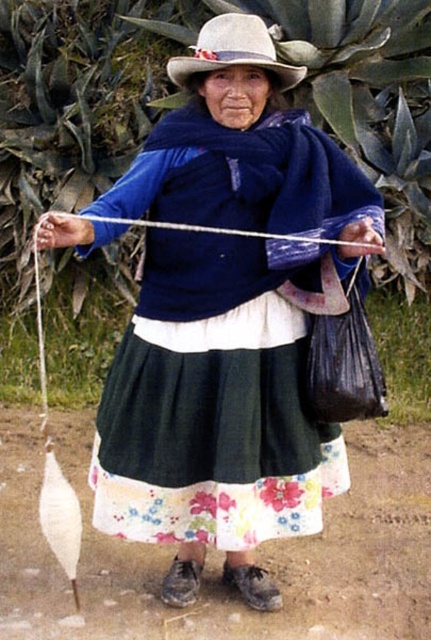
Which is in front, point (311, 272) or point (368, 224)?

Point (368, 224) is in front.

Which is more to the left, matte blue sweater at center or white string at center?

matte blue sweater at center

Locate an element on the screen. matte blue sweater at center is located at coordinates (227, 317).

Can you confirm if matte blue sweater at center is positioned above white felt cowboy hat at upper center?

No, matte blue sweater at center is not above white felt cowboy hat at upper center.

Describe the element at coordinates (227, 317) in the screenshot. I see `matte blue sweater at center` at that location.

The width and height of the screenshot is (431, 640). In order to click on matte blue sweater at center in this screenshot , I will do `click(227, 317)`.

Who is taller, white felt cowboy hat at upper center or white string at center?

white felt cowboy hat at upper center

Who is more distant from viewer, (205, 56) or (374, 250)?

The point (205, 56) is behind.

Where is `white felt cowboy hat at upper center`? white felt cowboy hat at upper center is located at coordinates (234, 51).